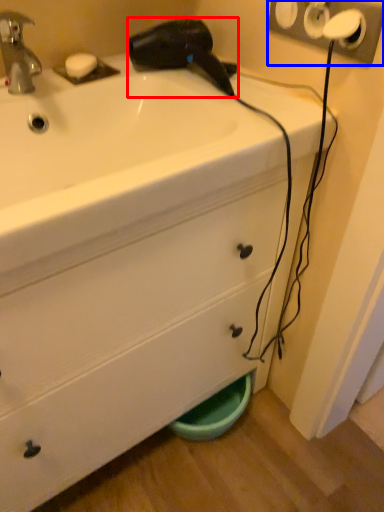
Question: Among these objects, which one is nearest to the camera, hair drier (highlighted by a red box) or electric outlet (highlighted by a blue box)?

Choices:
 (A) hair drier
 (B) electric outlet

Answer: (B)